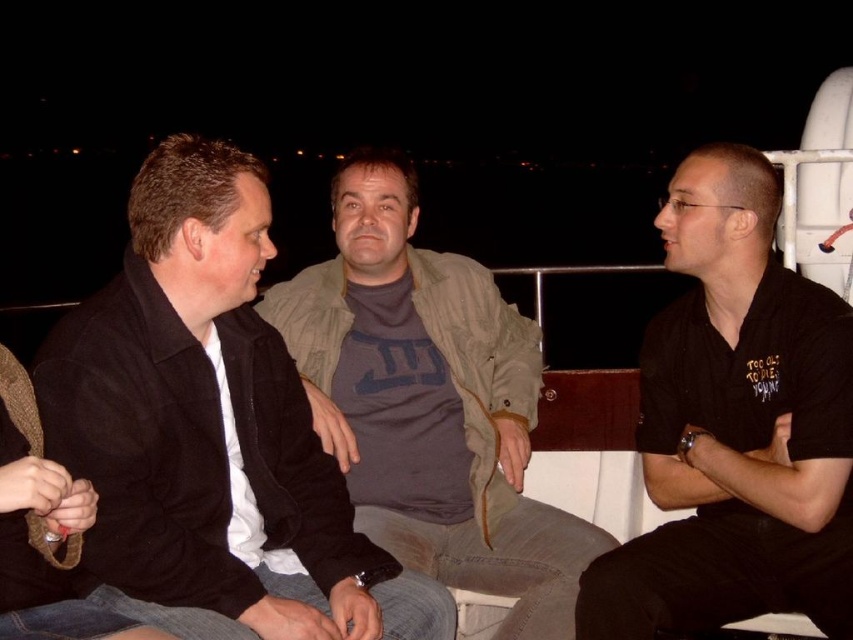
You are a photographer trying to capture a group photo of the black matte shirt at center and the dark gray cotton shirt at center. Since you want to ensure both shirts are clearly visible, which shirt should you focus on first to avoid blurring due to their size difference?

The black matte shirt at center has a smaller size compared to dark gray cotton shirt at center, so you should focus on the dark gray cotton shirt at center first as it is larger and might require more precise focus to capture details clearly.

From the picture: You are a photographer trying to capture a candid shot of the black matte jacket at left and the black matte shirt at center. Since the scene is dimly lit, you need to adjust your camera settings. To ensure both subjects are in focus, which one should you prioritize focusing on first based on their positions?

The black matte jacket at left is located below the black matte shirt at center, so you should focus on the black matte shirt at center first since it is closer to the camera.